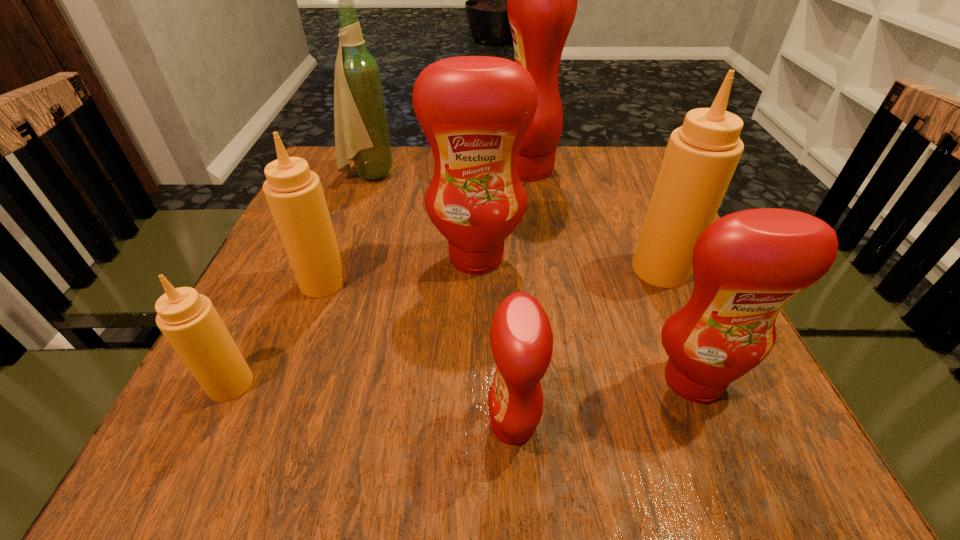
Locate an element on the screen. The width and height of the screenshot is (960, 540). empty location between the third biggest red condiment and the wine bottle is located at coordinates (531, 278).

I want to click on free spot between the second farthest red condiment and the smallest tan condiment, so click(353, 321).

Locate an element on the screen. Image resolution: width=960 pixels, height=540 pixels. vacant space that is in between the biggest tan condiment and the second tan condiment from right to left is located at coordinates (492, 275).

The height and width of the screenshot is (540, 960). Find the location of `free space between the smallest tan condiment and the second tan condiment from right to left`. free space between the smallest tan condiment and the second tan condiment from right to left is located at coordinates (276, 333).

This screenshot has height=540, width=960. Identify the location of object identified as the third closest to the rightmost red condiment. (475, 111).

Identify which object is located as the fifth nearest to the farthest red condiment. Please provide its 2D coordinates. Your answer should be formatted as a tuple, i.e. [(x, y)], where the tuple contains the x and y coordinates of a point satisfying the conditions above.

[(747, 265)]

The image size is (960, 540). Find the location of `condiment that is the closest to the second smallest red condiment`. condiment that is the closest to the second smallest red condiment is located at coordinates (701, 156).

I want to click on condiment that is the sixth closest one to the farthest condiment, so click(x=189, y=321).

This screenshot has height=540, width=960. Identify the location of the third closest red condiment to the biggest red condiment. (521, 338).

The image size is (960, 540). Find the location of `the second closest red condiment relative to the rightmost red condiment`. the second closest red condiment relative to the rightmost red condiment is located at coordinates (475, 111).